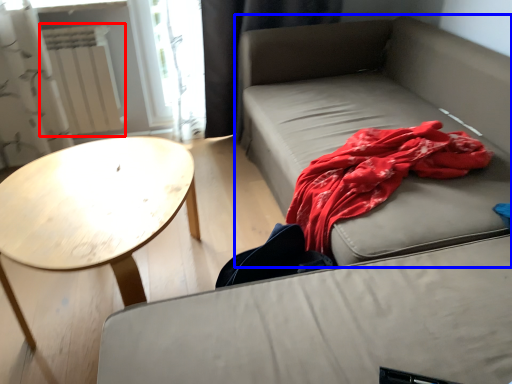
Question: Among these objects, which one is farthest to the camera, radiator (highlighted by a red box) or studio couch (highlighted by a blue box)?

Choices:
 (A) radiator
 (B) studio couch

Answer: (A)